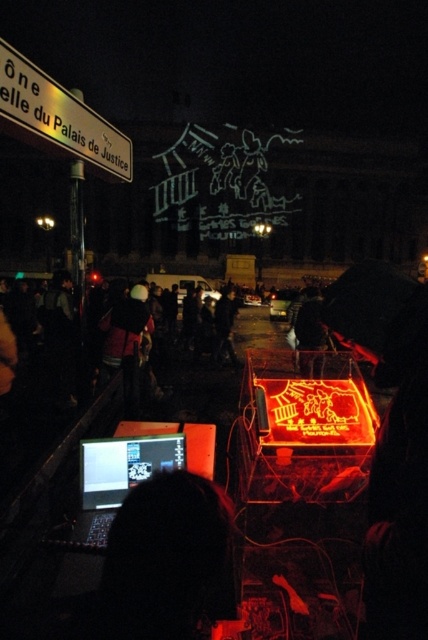
In the scene shown: Does metallic silver sign at upper left have a larger size compared to matte black laptop at lower left?

Indeed, metallic silver sign at upper left has a larger size compared to matte black laptop at lower left.

Who is taller, metallic silver sign at upper left or matte black laptop at lower left?

metallic silver sign at upper left

This screenshot has width=428, height=640. What are the coordinates of `metallic silver sign at upper left` in the screenshot? It's located at (58, 118).

Is point (146, 483) farther from camera compared to point (2, 113)?

That is False.

Where is `black matte laptop at lower left`? black matte laptop at lower left is located at coordinates (166, 561).

Is point (154, 524) closer to camera compared to point (116, 472)?

That is True.

Which of these two, black matte laptop at lower left or matte black laptop at lower left, stands shorter?

matte black laptop at lower left

I want to click on black matte laptop at lower left, so click(166, 561).

Identify the location of black matte laptop at lower left. This screenshot has width=428, height=640. (166, 561).